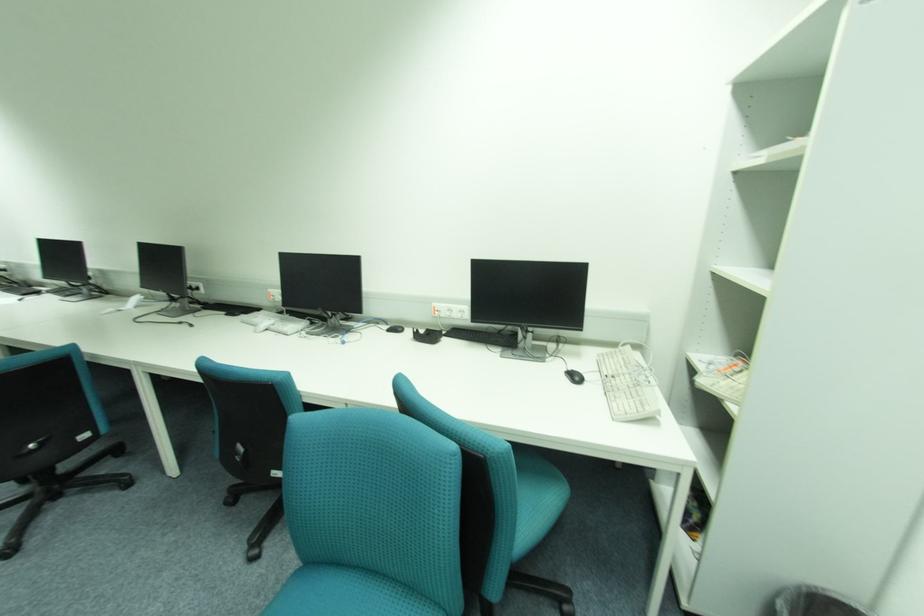
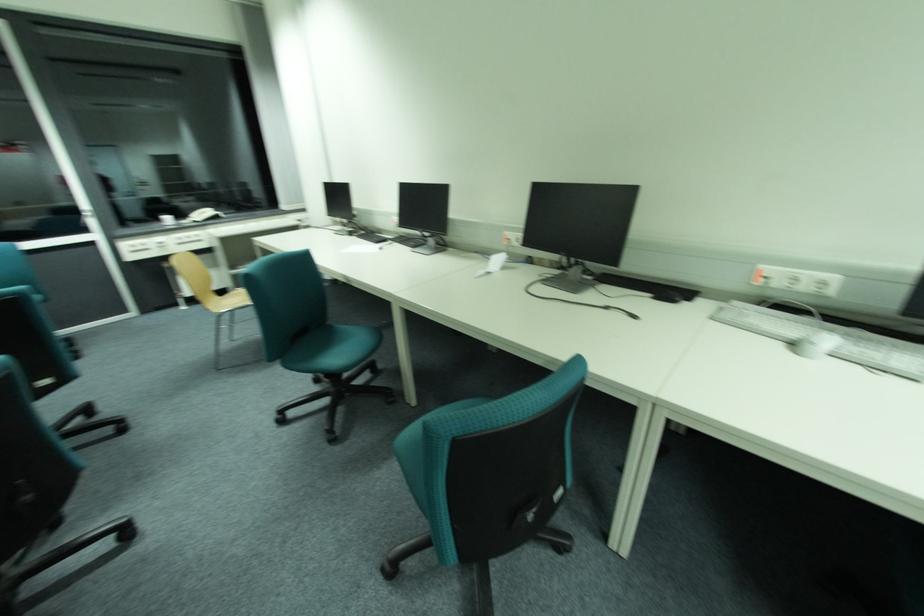
What movement of the cameraman would produce the second image?

The cameraman moved toward left, forward.